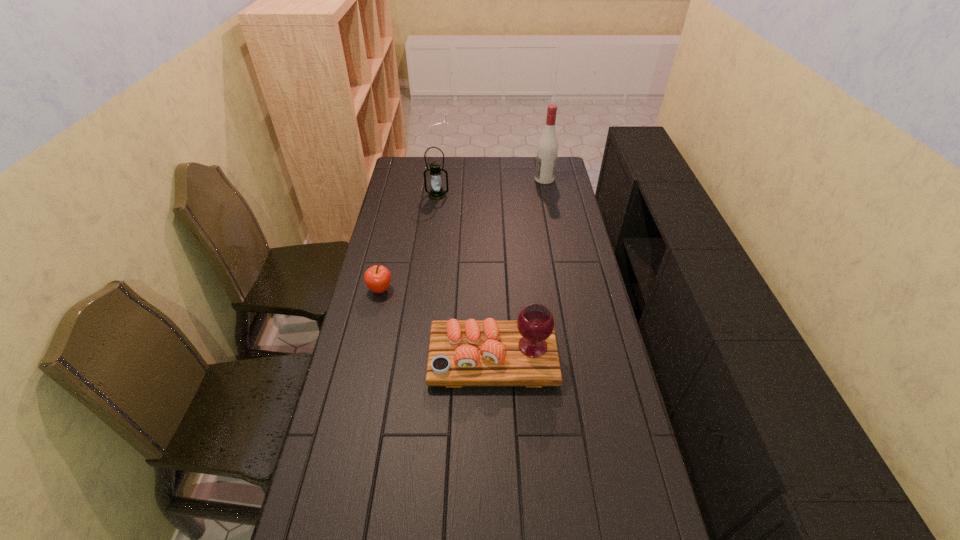
I want to click on the tallest object, so click(547, 150).

Where is `alcohol`? The height and width of the screenshot is (540, 960). alcohol is located at coordinates (547, 150).

Find the location of a particular element. This screenshot has height=540, width=960. the second farthest object is located at coordinates (436, 193).

This screenshot has height=540, width=960. What are the coordinates of `lantern` in the screenshot? It's located at (436, 193).

What are the coordinates of `platter` in the screenshot? It's located at (461, 353).

I want to click on the nearest object, so click(x=461, y=353).

This screenshot has width=960, height=540. What are the coordinates of `apple` in the screenshot? It's located at (377, 278).

Find the location of a particular element. the third farthest object is located at coordinates (377, 278).

You are a GUI agent. You are given a task and a screenshot of the screen. Output one action in this format:
    pyautogui.click(x=<x>, y=<y>)
    Task: Click on the vacant space situated on the label of the tallest object
    
    Given the screenshot: What is the action you would take?
    pyautogui.click(x=522, y=179)

Find the location of a particular element. Image resolution: width=960 pixels, height=540 pixels. free region located on the label of the tallest object is located at coordinates (510, 179).